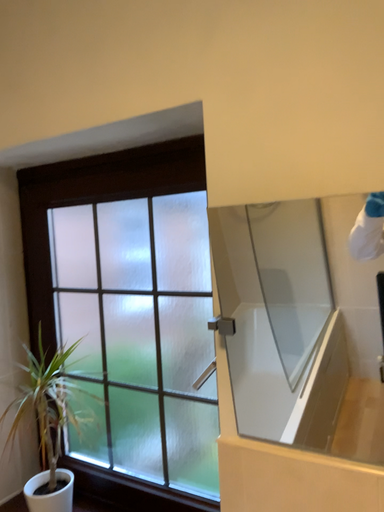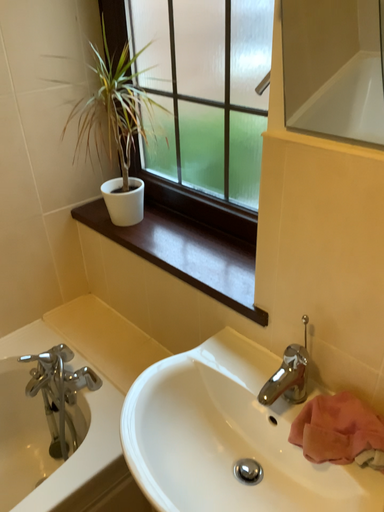
Question: How did the camera likely rotate when shooting the video?

Choices:
 (A) rotated downward
 (B) rotated upward

Answer: (A)